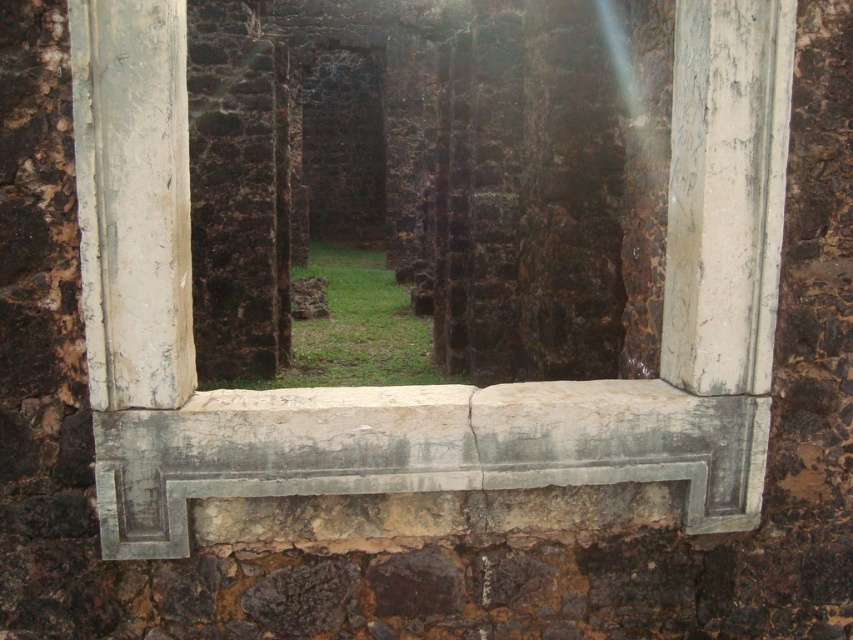
Question: Does white weathered wood at center have a larger size compared to gray stone window sill at center?

Choices:
 (A) yes
 (B) no

Answer: (A)

Question: Can you confirm if white weathered wood at center is positioned above gray stone window sill at center?

Choices:
 (A) no
 (B) yes

Answer: (B)

Question: Among these points, which one is nearest to the camera?

Choices:
 (A) (572, 410)
 (B) (439, 413)

Answer: (B)

Question: Is white weathered wood at center below gray stone window sill at center?

Choices:
 (A) no
 (B) yes

Answer: (A)